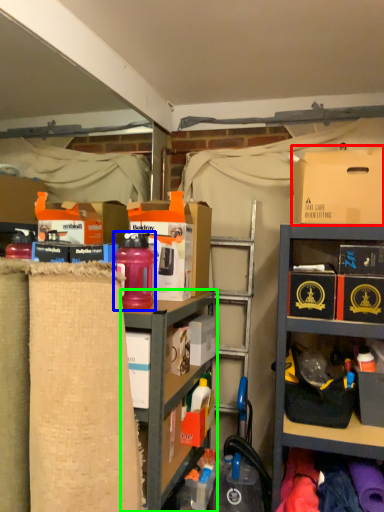
Question: Based on their relative distances, which object is farther from cardboard box (highlighted by a red box)? Choose from bottle (highlighted by a blue box) and shelf (highlighted by a green box).

Choices:
 (A) bottle
 (B) shelf

Answer: (B)